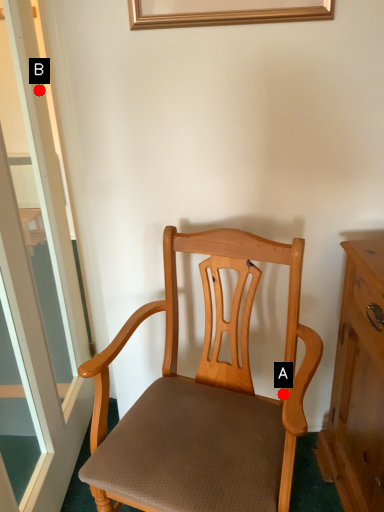
Question: Two points are circled on the image, labeled by A and B beside each circle. Which of the following is the farthest from the observer?

Choices:
 (A) A is further
 (B) B is further

Answer: (B)